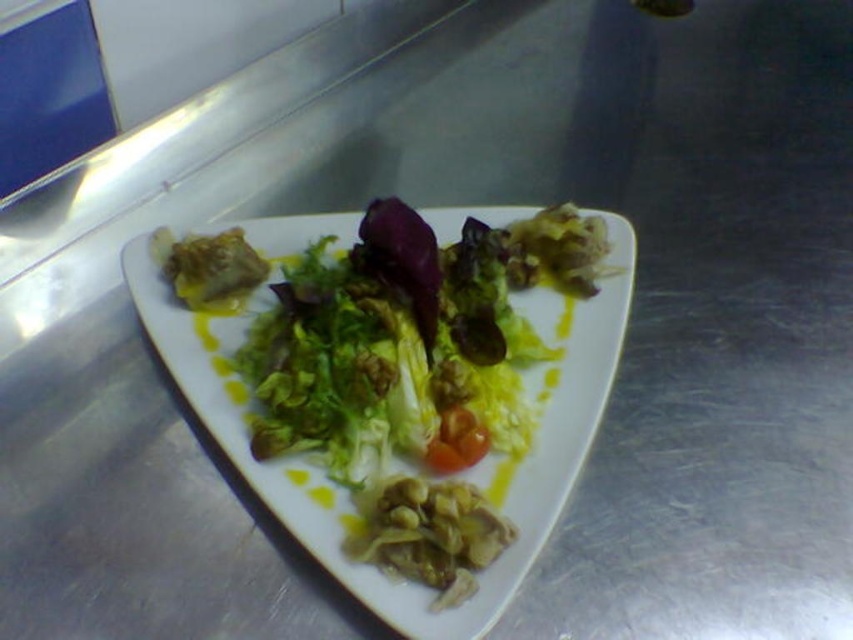
You are arranging items on a kitchen counter and need to place a blue container on the left side of the white glossy platter at center. According to the image, where should you position the blue container relative to the platter?

The white glossy platter at center is located at point [350,496], so the blue container should be placed to the left of this coordinate to position it on the left side of the platter.

You are a chef preparing a dish and need to place a garnish on top of the white glossy platter at center. However, there is a glossy red tomato at center nearby. Which object is taller, making it the better choice for placing the garnish on top?

The white glossy platter at center is much taller than the glossy red tomato at center, so placing the garnish on top of the white glossy platter at center would be more stable and visible.

You are arranging food on a kitchen counter and need to place a white glossy platter at center and a glossy red tomato at center. According to the image, which object is closer to you?

The white glossy platter at center is closer to you than the glossy red tomato at center.